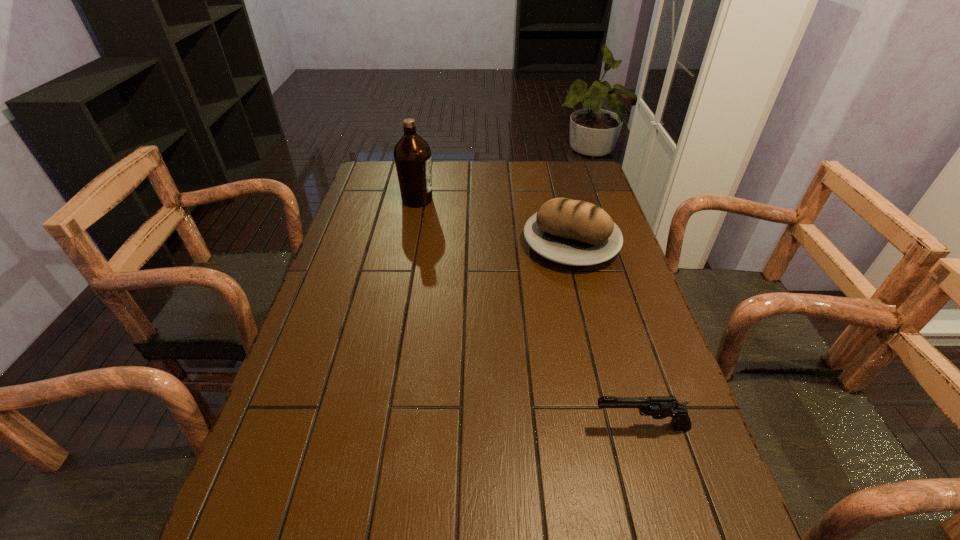
At what (x,y) coordinates should I click in order to perform the action: click on vacant area that lies between the tallest object and the nearest object. Please return your answer as a coordinate pair (x, y). This screenshot has width=960, height=540. Looking at the image, I should click on (529, 313).

Find the location of a particular element. The width and height of the screenshot is (960, 540). vacant space that is in between the leftmost object and the gun is located at coordinates (529, 313).

Find the location of a particular element. vacant area that lies between the farthest object and the second farthest object is located at coordinates (x=494, y=221).

Where is `unoccupied position between the olive oil and the second shortest object`? unoccupied position between the olive oil and the second shortest object is located at coordinates (494, 221).

The height and width of the screenshot is (540, 960). Identify the location of vacant point located between the bread and the tallest object. (494, 221).

At what (x,y) coordinates should I click in order to perform the action: click on free spot between the bread and the nearest object. Please return your answer as a coordinate pair (x, y). The image size is (960, 540). Looking at the image, I should click on (606, 335).

The height and width of the screenshot is (540, 960). Find the location of `free point between the farthest object and the nearest object`. free point between the farthest object and the nearest object is located at coordinates (529, 313).

At what (x,y) coordinates should I click in order to perform the action: click on vacant space in between the bread and the gun. Please return your answer as a coordinate pair (x, y). Image resolution: width=960 pixels, height=540 pixels. Looking at the image, I should click on (606, 335).

You are a GUI agent. You are given a task and a screenshot of the screen. Output one action in this format:
    pyautogui.click(x=<x>, y=<y>)
    Task: Click on the unoccupied position between the farthest object and the shortest object
    Image resolution: width=960 pixels, height=540 pixels.
    Given the screenshot: What is the action you would take?
    pyautogui.click(x=529, y=313)

Locate an element on the screen. The width and height of the screenshot is (960, 540). object identified as the closest to the leftmost object is located at coordinates (572, 232).